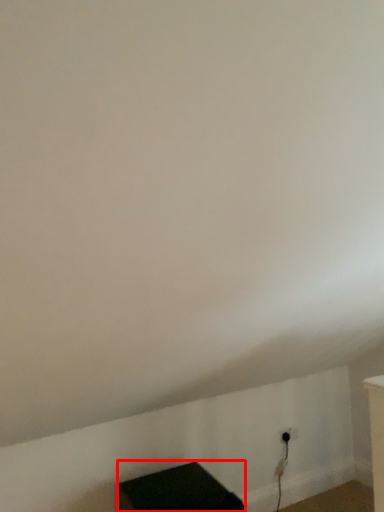
Question: Where is furniture (annotated by the red box) located in relation to electric outlet in the image?

Choices:
 (A) left
 (B) right

Answer: (A)